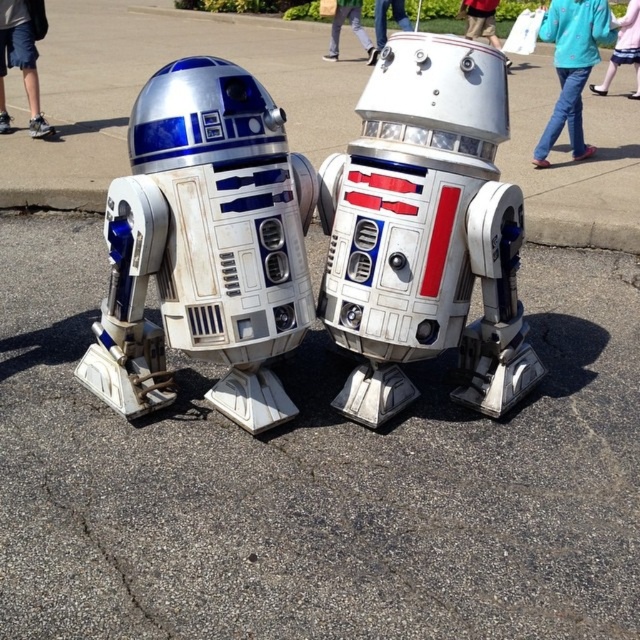
You are a Star Wars fan attending a convention and see two R2 units. You notice a brushed metal shorts at left and another object. Which R2 unit is positioned to the left side?

The brushed metal shorts at left is positioned to the left side.

You are a Star Wars fan attending a convention and see two droids in the image. You need to determine which one is taller between the brushed metal shorts at left and the blue fabric pants at upper center. Can you help?

The brushed metal shorts at left is much taller than the blue fabric pants at upper center, so the brushed metal shorts at left is the taller one.